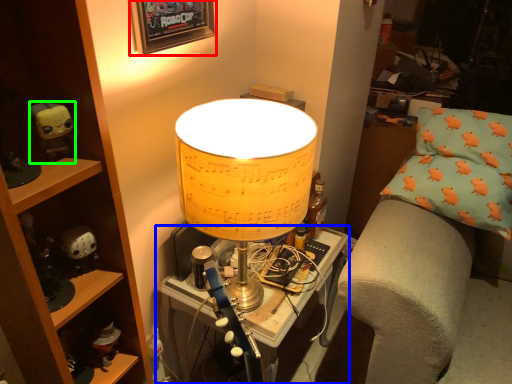
Question: Estimate the real-world distances between objects in this image. Which object is farther from picture frame (highlighted by a red box), table (highlighted by a blue box) or toy (highlighted by a green box)?

Choices:
 (A) table
 (B) toy

Answer: (A)